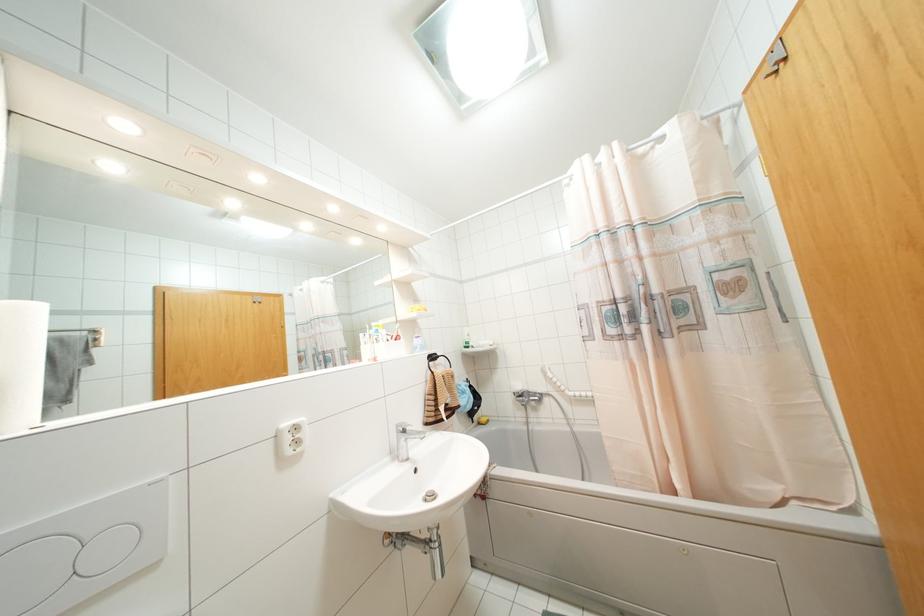
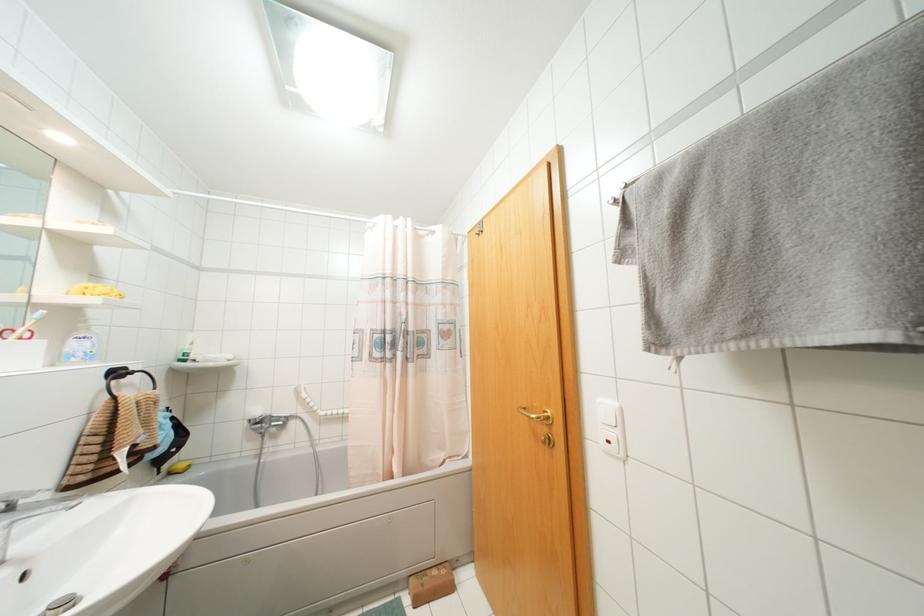
In the second image, find the point that corresponds to pixel 468 334 in the first image.

(190, 342)